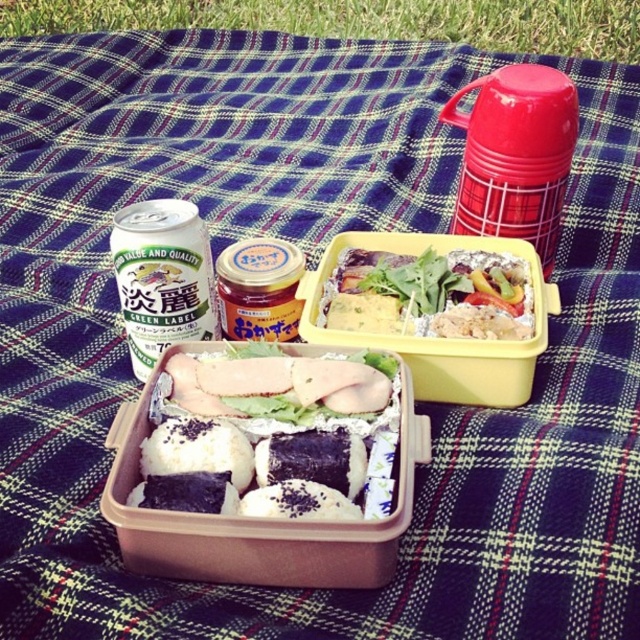
Who is positioned more to the right, white rice with nori at center or purple rice ball at center?

purple rice ball at center

Is point (141, 440) more distant than point (356, 488)?

Yes.

Is point (358, 356) farther from viewer compared to point (278, 458)?

That is True.

What are the coordinates of `white rice with nori at center` in the screenshot? It's located at (269, 435).

Is green label can at left closer to camera compared to purple rice ball at center?

No.

In the scene shown: Is green label can at left above purple rice ball at center?

Yes, green label can at left is above purple rice ball at center.

Is point (182, 305) closer to camera compared to point (257, 470)?

No, (182, 305) is further to viewer.

Where is `green label can at left`? This screenshot has height=640, width=640. green label can at left is located at coordinates [163, 276].

Does white rice with nori at center lie behind vibrant mixed vegetables at center?

No, white rice with nori at center is closer to the viewer.

Is white rice with nori at center positioned in front of vibrant mixed vegetables at center?

Yes, white rice with nori at center is closer to the viewer.

Which is in front, point (220, 403) or point (372, 300)?

Point (220, 403) is more forward.

This screenshot has width=640, height=640. Find the location of `white rice with nori at center`. white rice with nori at center is located at coordinates (269, 435).